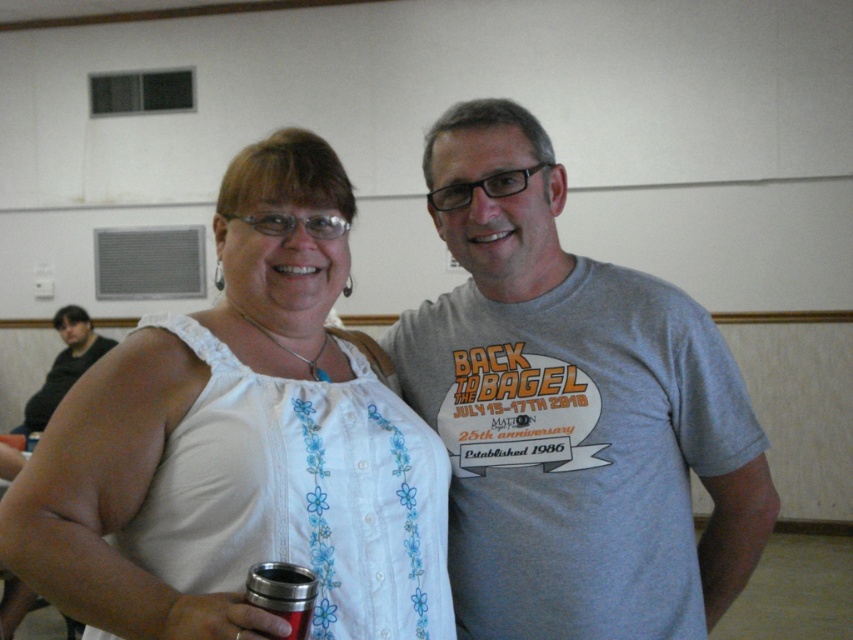
You are at a social event and want to hand a gift to the person wearing the white embroidered tank top at center without accidentally giving it to the person wearing the matte white tank top at center. Which person should you approach based on their position?

You should approach the person wearing the white embroidered tank top at center because they are closer to you than the matte white tank top at center.

You are organizing a clothing sale and need to display the white embroidered tank top at center and the matte white tank top at center on a rack. If the rack has a limited width, which tank top should you place first to ensure both fit?

The white embroidered tank top at center has a smaller width than the matte white tank top at center, so place the white embroidered tank top at center first to accommodate both on the rack.